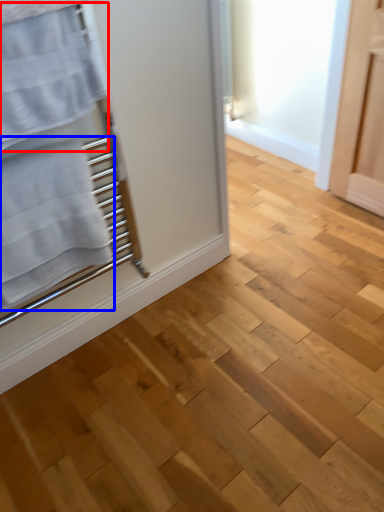
Question: Which object is further to the camera taking this photo, bath towel (highlighted by a red box) or bath towel (highlighted by a blue box)?

Choices:
 (A) bath towel
 (B) bath towel

Answer: (B)